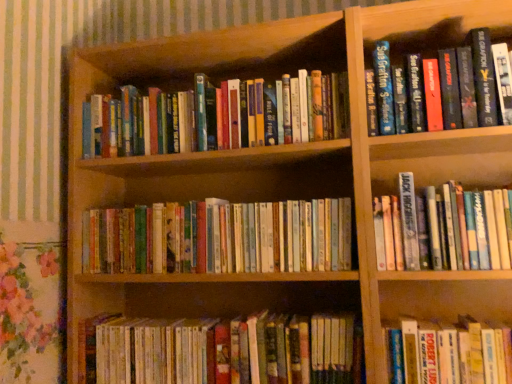
Question: From a real-world perspective, is hardcover book at upper right, the 1th book when ordered from top to bottom, physically above hardcover book at lower right, which is counted as the fifth book, starting from the top?

Choices:
 (A) no
 (B) yes

Answer: (B)

Question: Considering the relative positions of hardcover book at upper right, positioned as the sixth book in bottom-to-top order, and hardcover book at lower right, which is counted as the fifth book, starting from the top, in the image provided, is hardcover book at upper right, positioned as the sixth book in bottom-to-top order, in front of hardcover book at lower right, which is counted as the fifth book, starting from the top,?

Choices:
 (A) no
 (B) yes

Answer: (A)

Question: Is hardcover book at upper right, the 1th book when ordered from top to bottom, at the left side of hardcover book at lower right, which is counted as the fifth book, starting from the top?

Choices:
 (A) no
 (B) yes

Answer: (A)

Question: Is hardcover book at upper right, the 1th book when ordered from top to bottom, far from hardcover book at lower right, which is counted as the fifth book, starting from the top?

Choices:
 (A) yes
 (B) no

Answer: (B)

Question: Is hardcover book at upper right, positioned as the sixth book in bottom-to-top order, oriented towards hardcover book at lower right, the 2th book in the bottom-to-top sequence?

Choices:
 (A) no
 (B) yes

Answer: (A)

Question: From a real-world perspective, relative to hardcover books at center, the third book positioned from the bottom, is hardcover book at upper right, positioned as the sixth book in bottom-to-top order, vertically above or below?

Choices:
 (A) below
 (B) above

Answer: (B)

Question: Is hardcover book at upper right, positioned as the sixth book in bottom-to-top order, wider or thinner than hardcover books at center, placed as the fourth book when sorted from top to bottom?

Choices:
 (A) wide
 (B) thin

Answer: (A)

Question: Based on their positions, is hardcover book at upper right, the 1th book when ordered from top to bottom, located to the left or right of hardcover books at center, the third book positioned from the bottom?

Choices:
 (A) right
 (B) left

Answer: (A)

Question: In terms of size, does hardcover book at upper right, the 1th book when ordered from top to bottom, appear bigger or smaller than hardcover books at center, placed as the fourth book when sorted from top to bottom?

Choices:
 (A) big
 (B) small

Answer: (B)

Question: Considering the positions of hardcover books at center, the second book from the top, and hardcover books at center, placed as the fourth book when sorted from top to bottom, in the image, is hardcover books at center, the second book from the top, wider or thinner than hardcover books at center, placed as the fourth book when sorted from top to bottom,?

Choices:
 (A) thin
 (B) wide

Answer: (B)

Question: From a real-world perspective, relative to hardcover books at center, placed as the fourth book when sorted from top to bottom, is hardcover books at center, the second book from the top, vertically above or below?

Choices:
 (A) above
 (B) below

Answer: (A)

Question: In terms of size, does hardcover books at center, the fifth book ordered from the bottom, appear bigger or smaller than hardcover books at center, placed as the fourth book when sorted from top to bottom?

Choices:
 (A) small
 (B) big

Answer: (B)

Question: Is point (x=290, y=84) closer or farther from the camera than point (x=123, y=253)?

Choices:
 (A) closer
 (B) farther

Answer: (A)

Question: Looking at the image, does hardcover book at upper right, the 1th book when ordered from top to bottom, seem bigger or smaller compared to hardcover books at center, the fifth book ordered from the bottom?

Choices:
 (A) small
 (B) big

Answer: (A)

Question: Considering the relative positions of hardcover book at upper right, positioned as the sixth book in bottom-to-top order, and hardcover books at center, the fifth book ordered from the bottom, in the image provided, is hardcover book at upper right, positioned as the sixth book in bottom-to-top order, to the left or to the right of hardcover books at center, the fifth book ordered from the bottom,?

Choices:
 (A) right
 (B) left

Answer: (A)